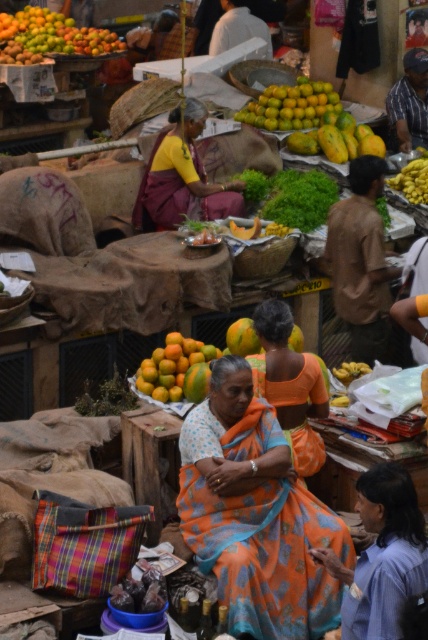
Based on the scene description, can you determine if the orange printed saree at center is wider than the matte yellow blouse at center?

The orange printed saree at center is wider than the matte yellow blouse at center according to the description provided.

You are a customer at the market and want to determine which clothing item is wider between the matte yellow blouse at center and the orange fabric saree at center. Which one is wider?

The matte yellow blouse at center is wider than the orange fabric saree at center according to the description.

You are a customer at the market and want to approach both the matte yellow blouse at center and the orange fabric saree at center. Which one should you walk towards first to reach the one closer to you?

You should first walk towards the matte yellow blouse at center because it is closer to you than the orange fabric saree at center.